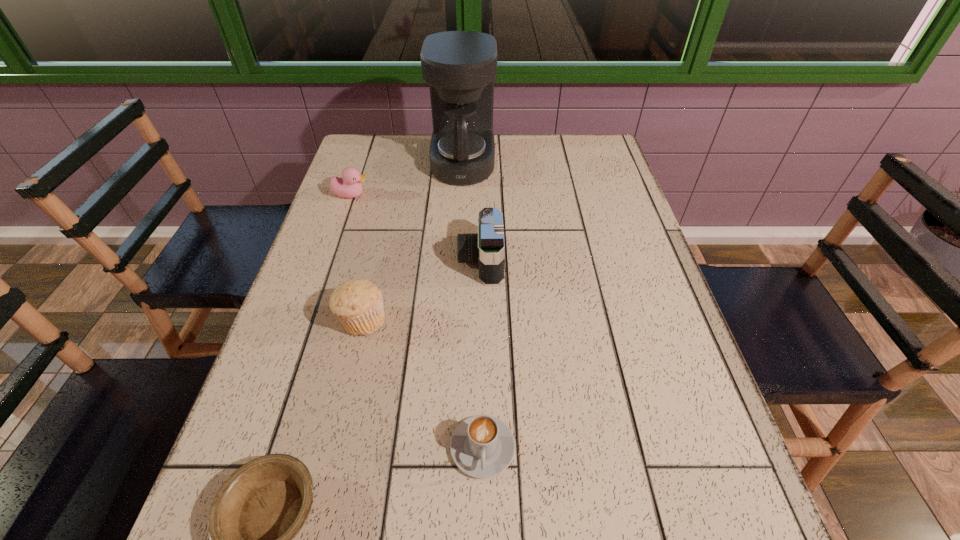
Locate an element on the screen. vacant position located 0.140m on the front of the muffin is located at coordinates (344, 400).

The width and height of the screenshot is (960, 540). Identify the location of vacant space located 0.110m on the front-facing side of the fifth nearest object. (407, 195).

Identify the location of free space located 0.070m to the right of the fifth tallest object. (483, 527).

At what (x,y) coordinates should I click in order to perform the action: click on object that is at the far edge. Please return your answer as a coordinate pair (x, y). Image resolution: width=960 pixels, height=540 pixels. Looking at the image, I should click on (460, 67).

The image size is (960, 540). I want to click on muffin that is at the left edge, so click(x=358, y=303).

Locate an element on the screen. This screenshot has width=960, height=540. duckling that is at the left edge is located at coordinates (349, 186).

The height and width of the screenshot is (540, 960). What are the coordinates of `free space at the far edge of the desktop` in the screenshot? It's located at (410, 148).

The image size is (960, 540). Identify the location of vacant space at the left edge of the desktop. (379, 211).

I want to click on vacant space at the right edge of the desktop, so point(628,331).

This screenshot has width=960, height=540. I want to click on free location at the far left corner, so click(360, 157).